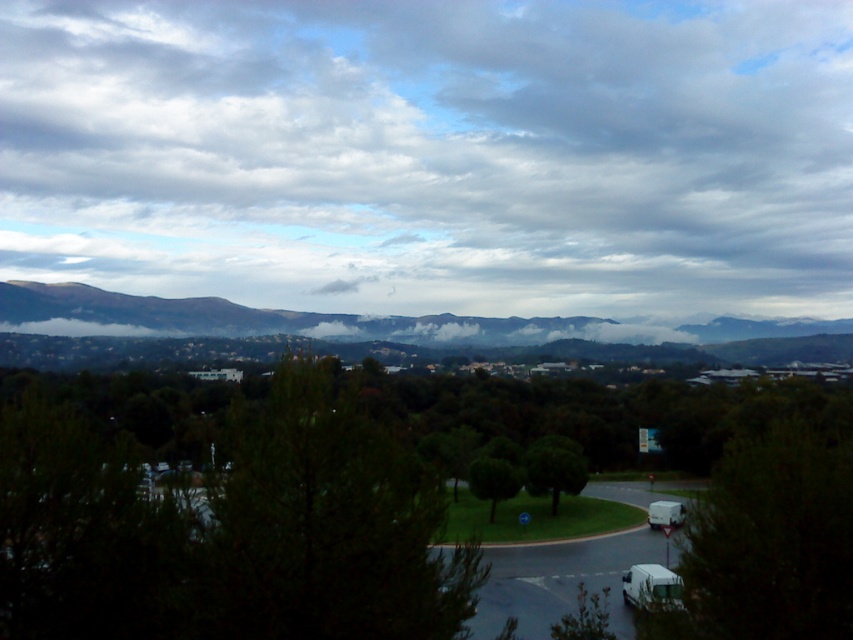
You are standing at the starting point of the road and want to reach the destination marked by the two points. Which point should you head towards first, point [822,76] or point [219,316]?

You should head towards point [822,76] first because it is closer to your current position at the starting point of the road compared to point [219,316], which is further away.

You are a pilot preparing to land a small airplane. You notice the cloudy sky at upper center and the green matte tree at center from the cockpit window. Which object appears larger in your view?

The cloudy sky at upper center appears larger than the green matte tree at center because it is bigger in size according to the description.